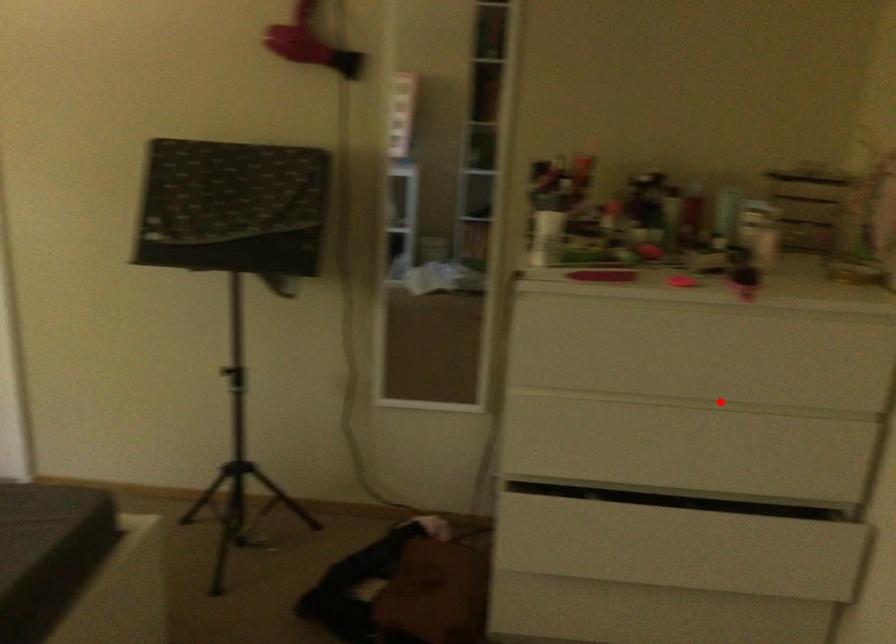
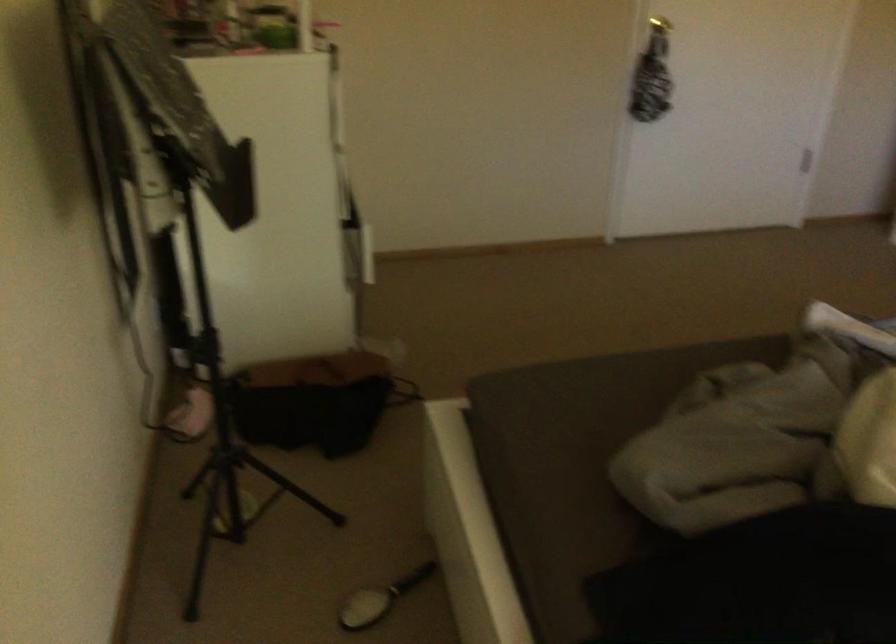
Question: I am providing you with two images of the same scene from different viewpoints. A red point is marked on the first image. Can you still see the location of the red point in image 2?

Choices:
 (A) Yes
 (B) No

Answer: (B)